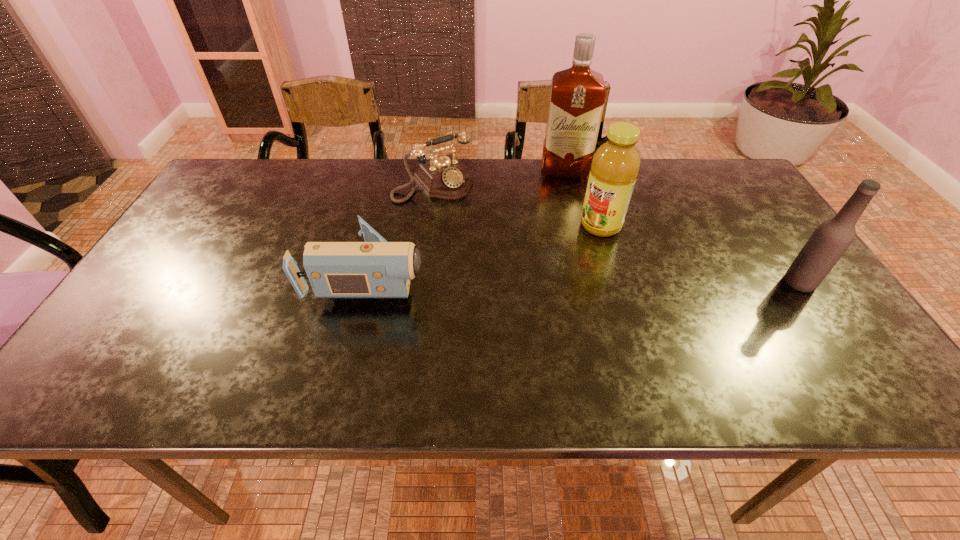
You are a GUI agent. You are given a task and a screenshot of the screen. Output one action in this format:
    pyautogui.click(x=<x>, y=<y>)
    Task: Click on the empty space that is in between the camcorder and the tallest object
    Image resolution: width=960 pixels, height=540 pixels.
    Given the screenshot: What is the action you would take?
    pyautogui.click(x=468, y=222)

The image size is (960, 540). Identify the location of free space between the tallest object and the fruit juice. (583, 198).

Where is `free space between the telephone and the camcorder`? free space between the telephone and the camcorder is located at coordinates (402, 229).

Locate an element on the screen. This screenshot has width=960, height=540. object that is the nearest to the telephone is located at coordinates (376, 268).

Locate which object is the second closest to the camcorder. Please provide its 2D coordinates. Your answer should be formatted as a tuple, i.e. [(x, y)], where the tuple contains the x and y coordinates of a point satisfying the conditions above.

[(615, 166)]

You are a GUI agent. You are given a task and a screenshot of the screen. Output one action in this format:
    pyautogui.click(x=<x>, y=<y>)
    Task: Click on the vacant area that satisfies the following two spatial constraints: 1. on the front side of the liquor; 2. on the side of the rightmost object with the label
    
    Given the screenshot: What is the action you would take?
    pyautogui.click(x=592, y=282)